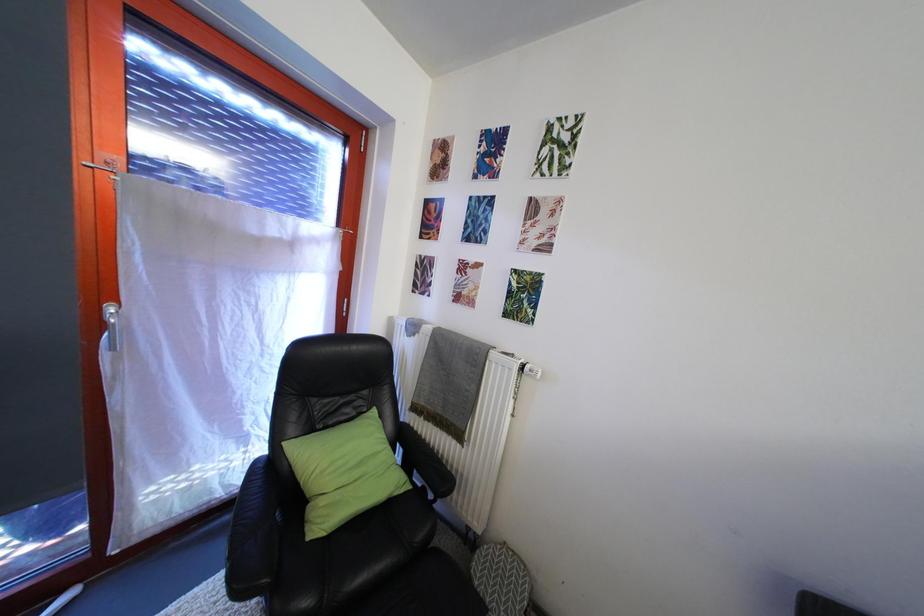
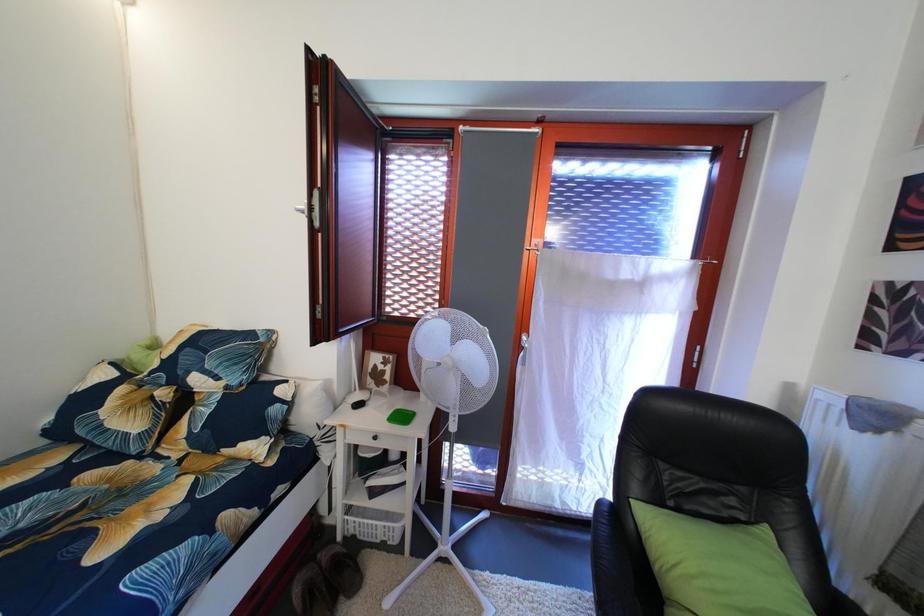
Question: Based on the continuous images, in which direction is the camera rotating? Reply with the corresponding letter.

Choices:
 (A) Left
 (B) Right
 (C) Up
 (D) Down

Answer: (A)